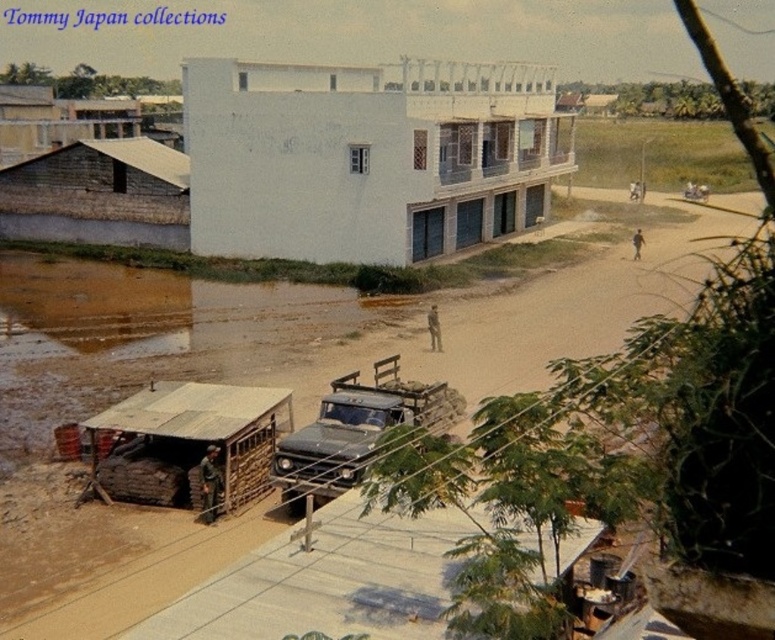
Question: Can you confirm if brown dirt track at center is positioned to the right of brown corrugated metal hut at lower left?

Choices:
 (A) yes
 (B) no

Answer: (A)

Question: Which object appears closest to the camera in this image?

Choices:
 (A) rusty metal jeep at center
 (B) wooden hut at left

Answer: (A)

Question: Is white smooth building at center bigger than wooden hut at left?

Choices:
 (A) no
 (B) yes

Answer: (B)

Question: Which object is farther from the camera taking this photo?

Choices:
 (A) rusty metal jeep at center
 (B) brown corrugated metal hut at lower left

Answer: (B)

Question: Considering the relative positions of rusty metal jeep at center and wooden shingles hut at upper left in the image provided, where is rusty metal jeep at center located with respect to wooden shingles hut at upper left?

Choices:
 (A) left
 (B) right

Answer: (B)

Question: Among these points, which one is farthest from the camera?

Choices:
 (A) (119, 499)
 (B) (336, 406)
 (C) (670, 209)
 (D) (522, 132)

Answer: (C)